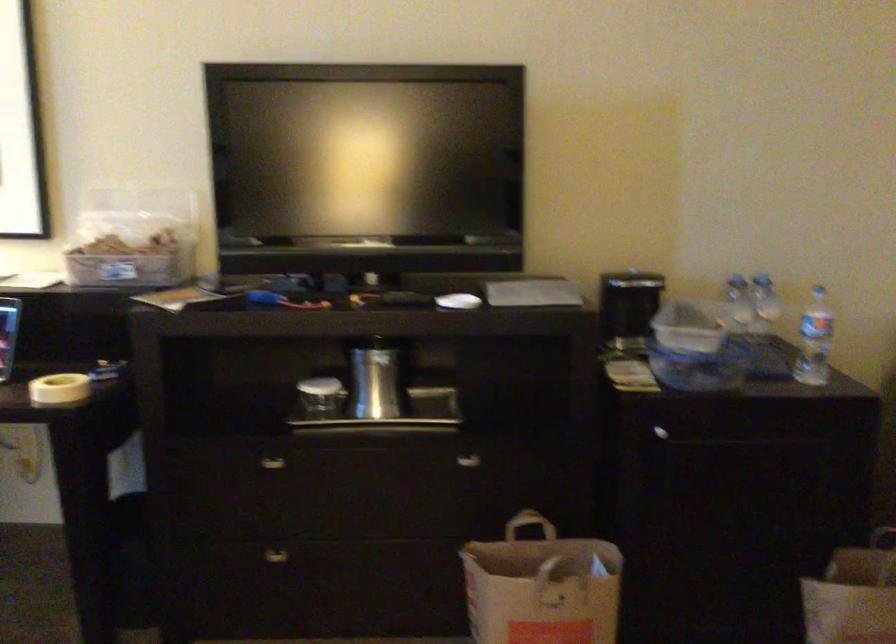
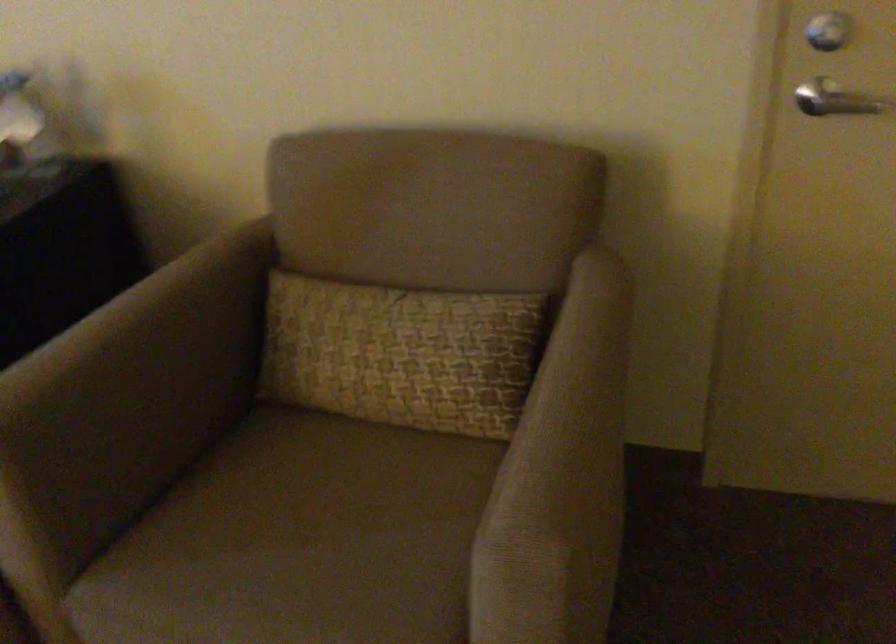
The images are taken continuously from a first-person perspective. In which direction are you moving?

The movement direction of the cameraman is right, forward.